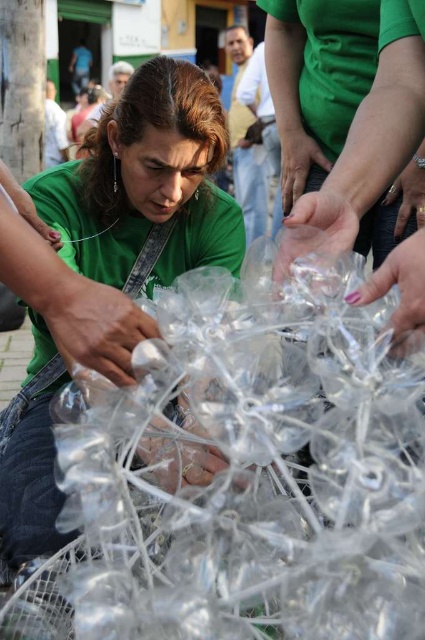
Question: Does transparent plastic at center have a greater width compared to green matte shirt at center?

Choices:
 (A) yes
 (B) no

Answer: (B)

Question: Is transparent plastic at center positioned behind green matte shirt at center?

Choices:
 (A) yes
 (B) no

Answer: (B)

Question: Is transparent plastic at center bigger than green matte shirt at center?

Choices:
 (A) no
 (B) yes

Answer: (A)

Question: Which of the following is the closest to the observer?

Choices:
 (A) transparent plastic at center
 (B) green matte shirt at center

Answer: (A)